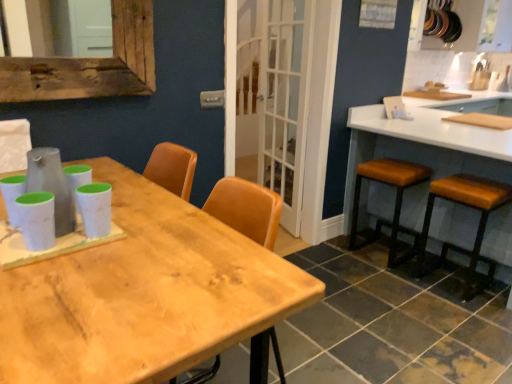
Question: Should I look upward or downward to see white matte chair at upper left?

Choices:
 (A) down
 (B) up

Answer: (B)

Question: Is white matte chair at upper left wider than brown leather stool at right, the second stool viewed from the left?

Choices:
 (A) yes
 (B) no

Answer: (B)

Question: Can you confirm if white matte chair at upper left is smaller than brown leather stool at right, positioned as the 1th stool in right-to-left order?

Choices:
 (A) yes
 (B) no

Answer: (A)

Question: From the image's perspective, is white matte chair at upper left below brown leather stool at right, positioned as the 1th stool in right-to-left order?

Choices:
 (A) no
 (B) yes

Answer: (A)

Question: Is white matte chair at upper left positioned far away from brown leather stool at right, positioned as the 1th stool in right-to-left order?

Choices:
 (A) no
 (B) yes

Answer: (B)

Question: Does white matte chair at upper left have a lesser width compared to brown leather stool at right, the second stool viewed from the left?

Choices:
 (A) no
 (B) yes

Answer: (B)

Question: Is white matte chair at upper left looking in the opposite direction of brown leather stool at right, positioned as the 1th stool in right-to-left order?

Choices:
 (A) no
 (B) yes

Answer: (A)

Question: Is wooden table at center looking in the opposite direction of brown leather stool at right, positioned as the 1th stool in right-to-left order?

Choices:
 (A) yes
 (B) no

Answer: (B)

Question: Could you tell me if wooden table at center is turned towards brown leather stool at right, the second stool viewed from the left?

Choices:
 (A) yes
 (B) no

Answer: (B)

Question: Considering the relative positions of wooden table at center and brown leather stool at right, positioned as the 1th stool in right-to-left order, in the image provided, is wooden table at center behind brown leather stool at right, positioned as the 1th stool in right-to-left order,?

Choices:
 (A) yes
 (B) no

Answer: (B)

Question: From the image's perspective, is wooden table at center located above brown leather stool at right, positioned as the 1th stool in right-to-left order?

Choices:
 (A) yes
 (B) no

Answer: (B)

Question: Is wooden table at center wider than brown leather stool at right, the second stool viewed from the left?

Choices:
 (A) yes
 (B) no

Answer: (A)

Question: Considering the relative positions of wooden table at center and brown leather stool at right, the second stool viewed from the left, in the image provided, is wooden table at center in front of brown leather stool at right, the second stool viewed from the left,?

Choices:
 (A) no
 (B) yes

Answer: (B)

Question: Is wooden table at center further to the viewer compared to white glossy countertop at right?

Choices:
 (A) no
 (B) yes

Answer: (A)